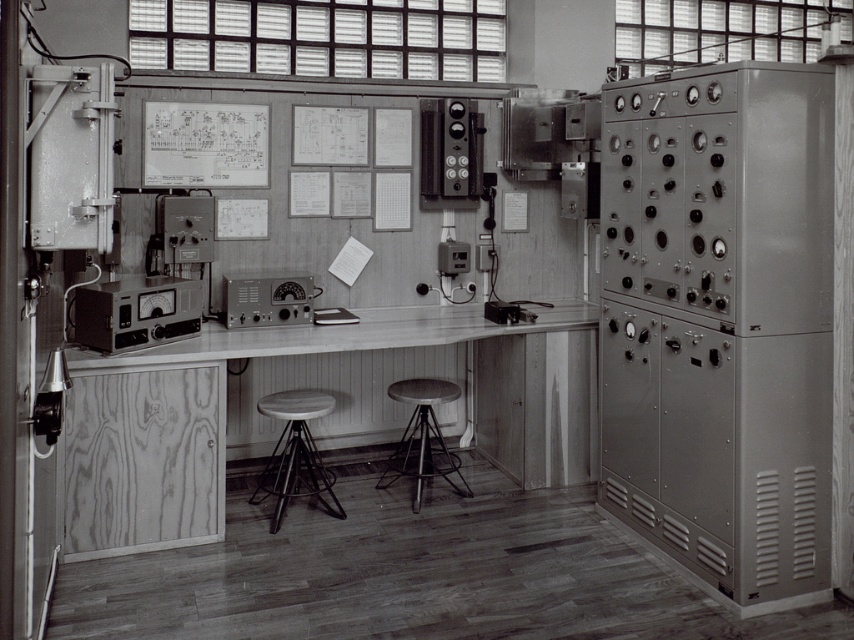
Which is more to the left, smooth wood table at center or metallic stool at center?

smooth wood table at center

Does smooth wood table at center have a greater width compared to metallic stool at center?

Indeed, smooth wood table at center has a greater width compared to metallic stool at center.

Who is more distant from viewer, (572, 385) or (436, 449)?

Positioned behind is point (436, 449).

Where is `smooth wood table at center`? Image resolution: width=854 pixels, height=640 pixels. smooth wood table at center is located at coordinates (303, 358).

Does metallic panel at right have a greater height compared to metallic silver radio at center?

Yes, metallic panel at right is taller than metallic silver radio at center.

Who is lower down, metallic panel at right or metallic silver radio at center?

Positioned lower is metallic panel at right.

Identify the location of metallic panel at right. Image resolution: width=854 pixels, height=640 pixels. (720, 323).

Can you confirm if metallic panel at right is positioned to the right of wooden seat stool at center?

Yes, metallic panel at right is to the right of wooden seat stool at center.

Who is taller, metallic panel at right or wooden seat stool at center?

metallic panel at right is taller.

Is point (784, 316) in front of point (297, 476)?

Yes.

Where is `metallic panel at right`? The width and height of the screenshot is (854, 640). metallic panel at right is located at coordinates (720, 323).